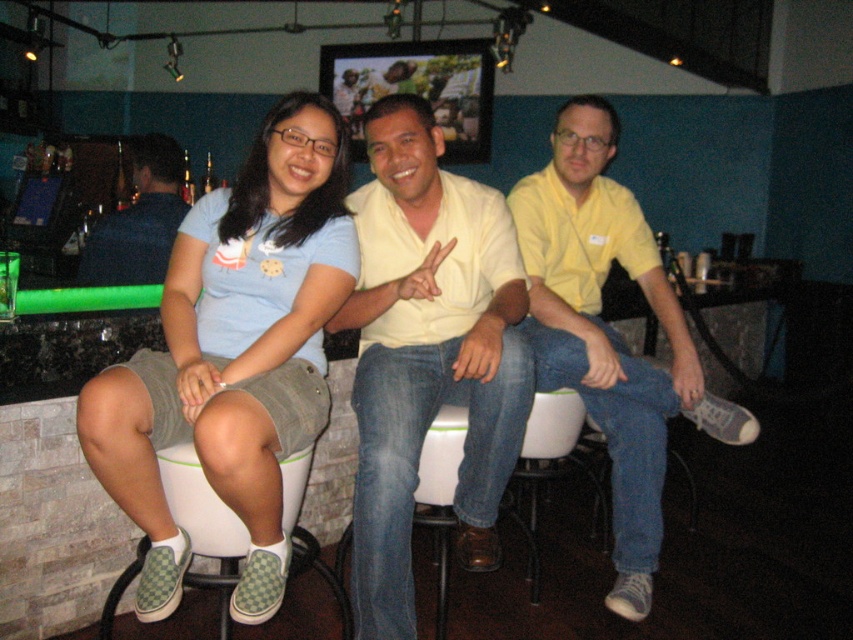
Is light blue t-shirt at center positioned behind dark blue shirt at left?

No.

Consider the image. Is light blue t-shirt at center thinner than dark blue shirt at left?

Indeed, light blue t-shirt at center has a lesser width compared to dark blue shirt at left.

Does point (164, 417) come in front of point (126, 211)?

Yes, point (164, 417) is in front of point (126, 211).

You are a GUI agent. You are given a task and a screenshot of the screen. Output one action in this format:
    pyautogui.click(x=<x>, y=<y>)
    Task: Click on the light blue t-shirt at center
    This screenshot has height=640, width=853.
    Given the screenshot: What is the action you would take?
    pyautogui.click(x=234, y=355)

Which is behind, point (607, 132) or point (117, 243)?

Point (117, 243)

How distant is matte yellow shirt at center from dark blue shirt at left?

matte yellow shirt at center and dark blue shirt at left are 4.81 feet apart from each other.

What do you see at coordinates (610, 332) in the screenshot? This screenshot has height=640, width=853. I see `matte yellow shirt at center` at bounding box center [610, 332].

Find the location of a particular element. The image size is (853, 640). matte yellow shirt at center is located at coordinates (610, 332).

Does matte yellow shirt at center appear on the left side of white rubber bar stool at lower left?

No, matte yellow shirt at center is not to the left of white rubber bar stool at lower left.

Is point (532, 344) less distant than point (199, 532)?

No, (532, 344) is further to viewer.

Locate an element on the screen. The height and width of the screenshot is (640, 853). matte yellow shirt at center is located at coordinates click(610, 332).